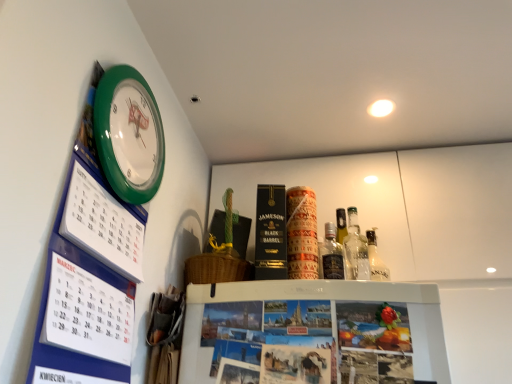
Question: Is translucent glass bottle at upper right to the left or to the right of green plastic wall clock at upper left in the image?

Choices:
 (A) left
 (B) right

Answer: (B)

Question: In terms of size, does translucent glass bottle at upper right appear bigger or smaller than green plastic wall clock at upper left?

Choices:
 (A) small
 (B) big

Answer: (A)

Question: Considering the real-world distances, which object is closest to the blue cardboard calendar at upper left?

Choices:
 (A) green plastic wall clock at upper left
 (B) translucent glass bottle at upper right

Answer: (A)

Question: Which object is the farthest from the translucent glass bottle at upper right?

Choices:
 (A) blue cardboard calendar at upper left
 (B) green plastic wall clock at upper left

Answer: (A)